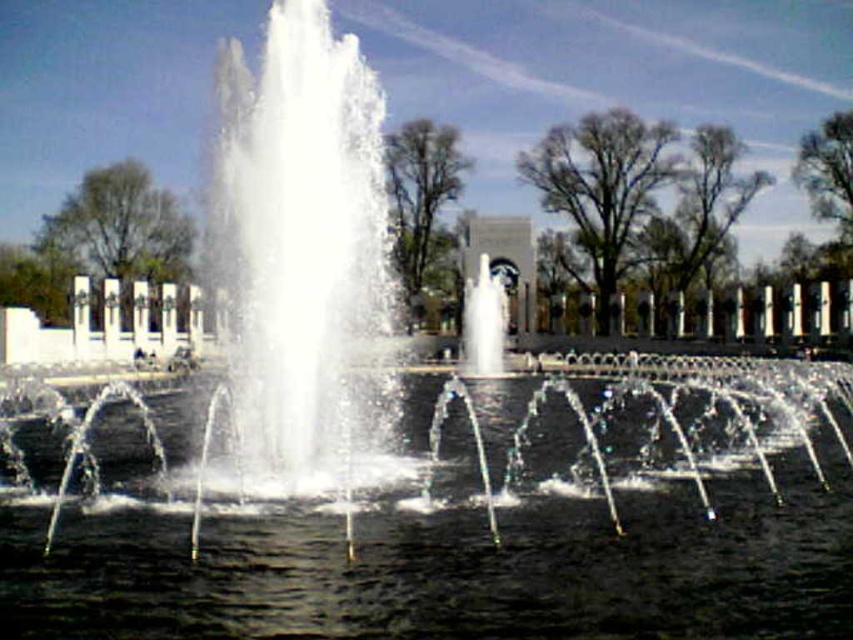
Question: Does clear water at center have a larger size compared to white marble fountain at center?

Choices:
 (A) yes
 (B) no

Answer: (A)

Question: Which point is closer to the camera?

Choices:
 (A) white marble fountain at center
 (B) clear water at center

Answer: (B)

Question: Which of the following is the closest to the observer?

Choices:
 (A) clear water at center
 (B) white marble fountain at center

Answer: (A)

Question: Does clear water at center appear under white marble fountain at center?

Choices:
 (A) no
 (B) yes

Answer: (B)

Question: Does clear water at center have a smaller size compared to white marble fountain at center?

Choices:
 (A) no
 (B) yes

Answer: (A)